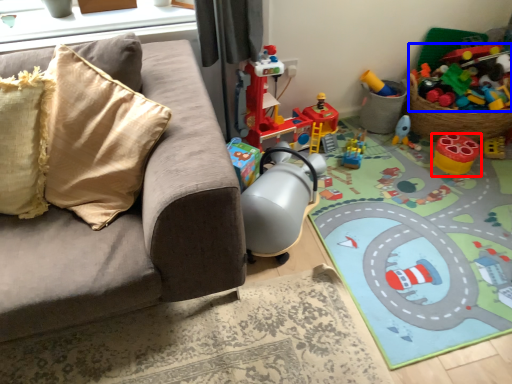
Question: Which object appears farthest to the camera in this image, toy (highlighted by a red box) or toy (highlighted by a blue box)?

Choices:
 (A) toy
 (B) toy

Answer: (B)